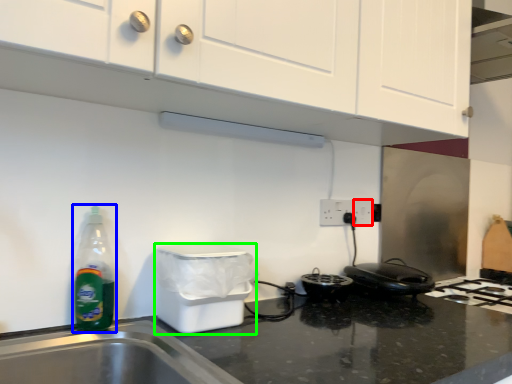
Question: Which object is positioned farthest from electric outlet (highlighted by a red box)? Select from bottle (highlighted by a blue box) and appliance (highlighted by a green box).

Choices:
 (A) bottle
 (B) appliance

Answer: (A)